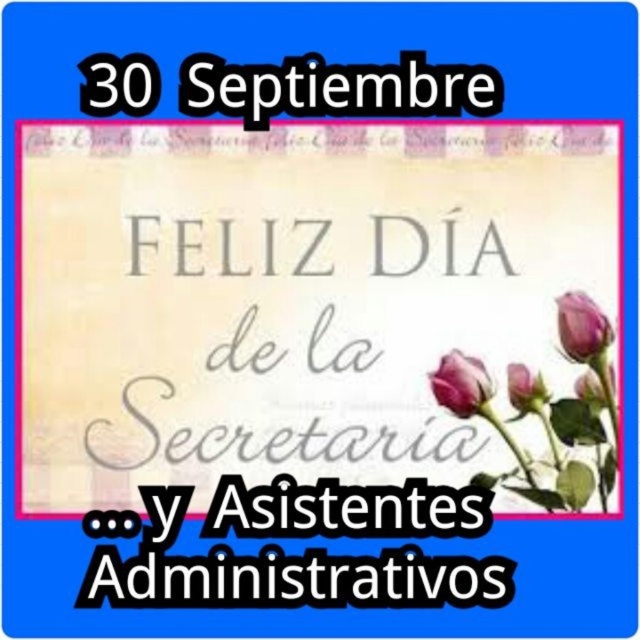
Can you confirm if purple matte rosebud at upper right is thinner than pink matte rose at lower right?

Yes.

Which is in front, point (540, 404) or point (605, 401)?

Positioned in front is point (605, 401).

Where is `purple matte rosebud at upper right`? The image size is (640, 640). purple matte rosebud at upper right is located at coordinates (525, 388).

Is pink matte rosebud at upper right further to the viewer compared to purple matte rosebud at upper right?

No, pink matte rosebud at upper right is closer to the viewer.

Which of these two, pink matte rosebud at upper right or purple matte rosebud at upper right, stands shorter?

With less height is purple matte rosebud at upper right.

Who is more forward, (566, 292) or (516, 406)?

Positioned in front is point (516, 406).

Locate an element on the screen. pink matte rosebud at upper right is located at coordinates (582, 326).

Can you confirm if purple matte rosebud at center is bigger than purple matte rosebud at upper right?

Yes.

This screenshot has width=640, height=640. What do you see at coordinates (460, 384) in the screenshot?
I see `purple matte rosebud at center` at bounding box center [460, 384].

Identify the location of purple matte rosebud at center. The width and height of the screenshot is (640, 640). (460, 384).